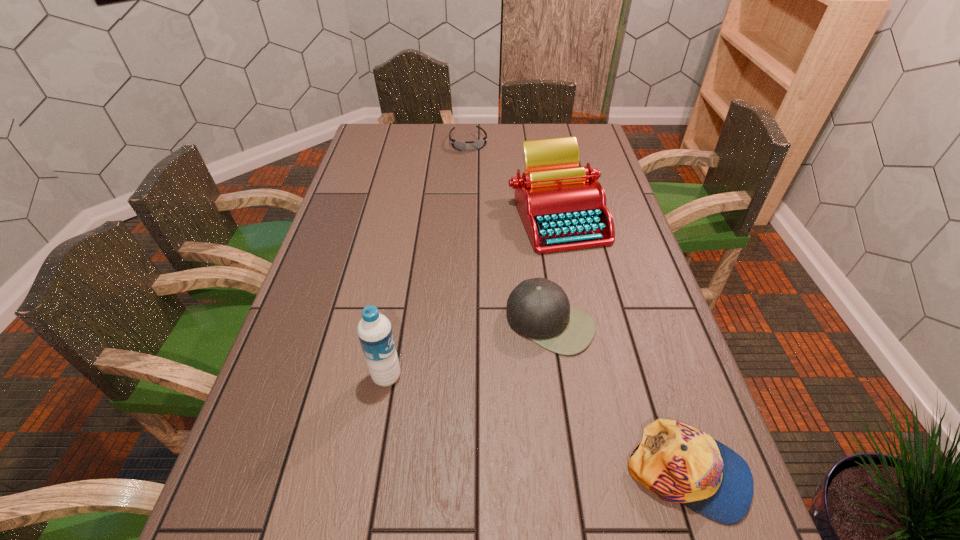
This screenshot has width=960, height=540. What are the coordinates of `the leftmost object` in the screenshot? It's located at (374, 330).

Locate an element on the screen. The width and height of the screenshot is (960, 540). the second nearest object is located at coordinates (374, 330).

I want to click on the nearer cap, so click(x=677, y=462).

Locate an element on the screen. typewriter is located at coordinates (563, 207).

Where is `the fourth shortest object`? This screenshot has height=540, width=960. the fourth shortest object is located at coordinates (563, 207).

Identify the location of the third nearest object. The height and width of the screenshot is (540, 960). (539, 309).

Image resolution: width=960 pixels, height=540 pixels. I want to click on the fourth object from right to left, so click(x=459, y=145).

You are a GUI agent. You are given a task and a screenshot of the screen. Output one action in this format:
    pyautogui.click(x=<x>, y=<y>)
    Task: Click on the sunglasses
    The height and width of the screenshot is (540, 960).
    Given the screenshot: What is the action you would take?
    pyautogui.click(x=459, y=145)

Locate an element on the screen. The width and height of the screenshot is (960, 540). free space located 0.290m on the label of the tallest object is located at coordinates (533, 377).

Identify the location of vacant point located 0.210m on the typing side of the typewriter. (530, 305).